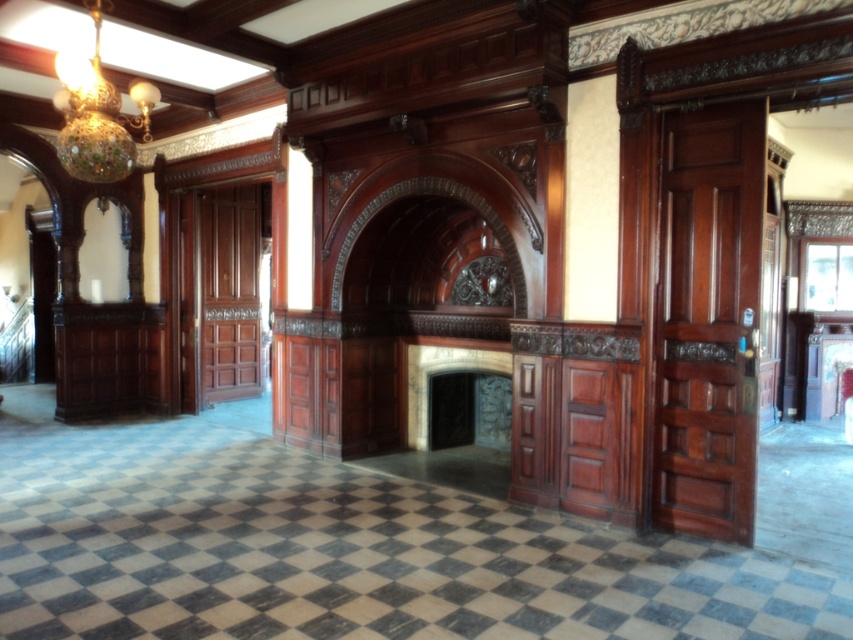
Question: Is multicolored glass chandelier at upper left further to camera compared to dark stone fireplace at center?

Choices:
 (A) yes
 (B) no

Answer: (B)

Question: Where is multicolored glass chandelier at upper left located in relation to dark stone fireplace at center in the image?

Choices:
 (A) above
 (B) below

Answer: (A)

Question: In this image, where is multicolored glass chandelier at upper left located relative to dark stone fireplace at center?

Choices:
 (A) above
 (B) below

Answer: (A)

Question: Which of the following is the closest to the observer?

Choices:
 (A) multicolored glass chandelier at upper left
 (B) dark stone fireplace at center

Answer: (A)